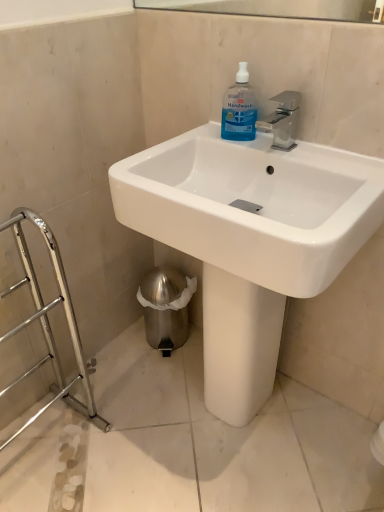
Question: Relative to transparent plastic handwash at upper center, is white glossy sink at center in front or behind?

Choices:
 (A) front
 (B) behind

Answer: (A)

Question: In terms of width, does white glossy sink at center look wider or thinner when compared to transparent plastic handwash at upper center?

Choices:
 (A) thin
 (B) wide

Answer: (B)

Question: From the image's perspective, relative to transparent plastic handwash at upper center, is white glossy sink at center above or below?

Choices:
 (A) above
 (B) below

Answer: (B)

Question: From the image's perspective, is transparent plastic handwash at upper center located above or below white glossy sink at center?

Choices:
 (A) above
 (B) below

Answer: (A)

Question: Is point (253, 137) positioned closer to the camera than point (246, 352)?

Choices:
 (A) farther
 (B) closer

Answer: (B)

Question: From a real-world perspective, is transparent plastic handwash at upper center positioned above or below white glossy sink at center?

Choices:
 (A) above
 (B) below

Answer: (A)

Question: Relative to white glossy sink at center, is transparent plastic handwash at upper center in front or behind?

Choices:
 (A) front
 (B) behind

Answer: (B)